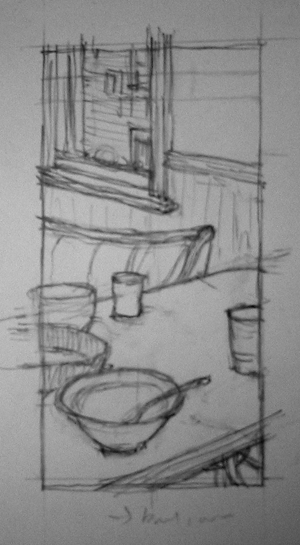
This screenshot has width=300, height=545. Find the location of `wood paneling`. wood paneling is located at coordinates pyautogui.click(x=224, y=197).